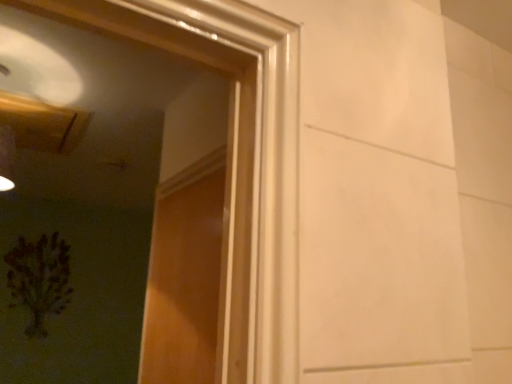
Image resolution: width=512 pixels, height=384 pixels. Identify the location of green matte plant at lower left. (39, 279).

The image size is (512, 384). What do you see at coordinates (39, 279) in the screenshot? I see `green matte plant at lower left` at bounding box center [39, 279].

This screenshot has height=384, width=512. Find the location of `green matte plant at lower left`. green matte plant at lower left is located at coordinates 39,279.